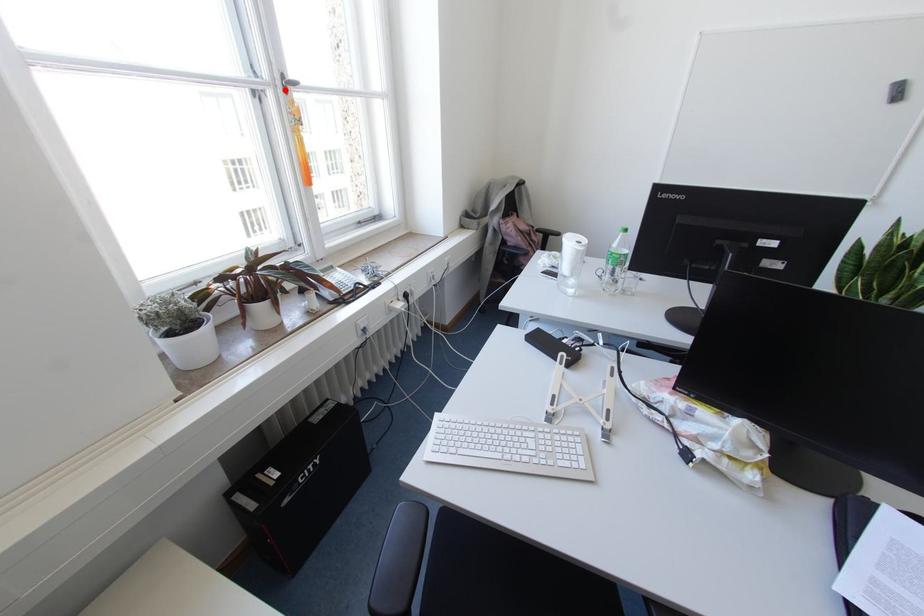
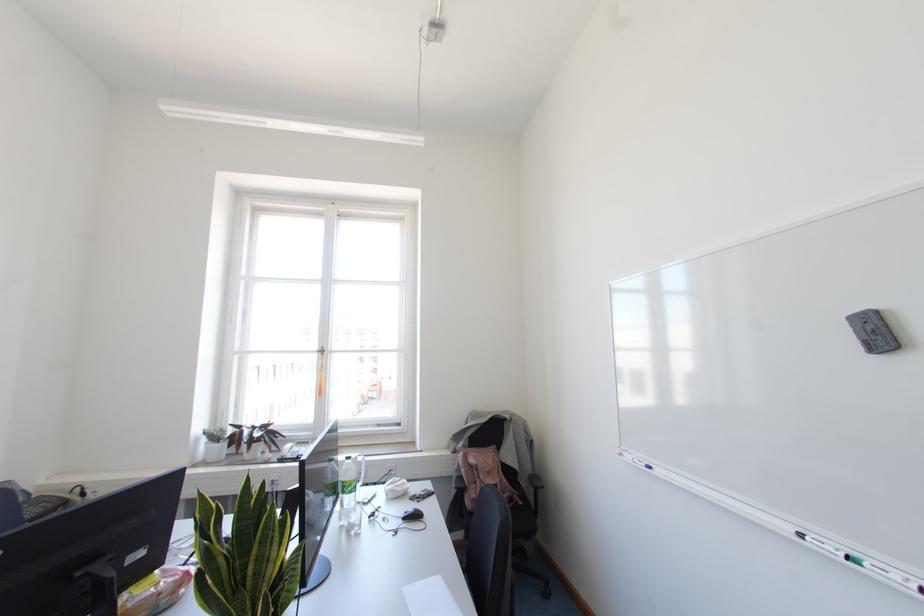
Where in the second image is the point corresponding to the highlighted location from the first image?

(322, 353)